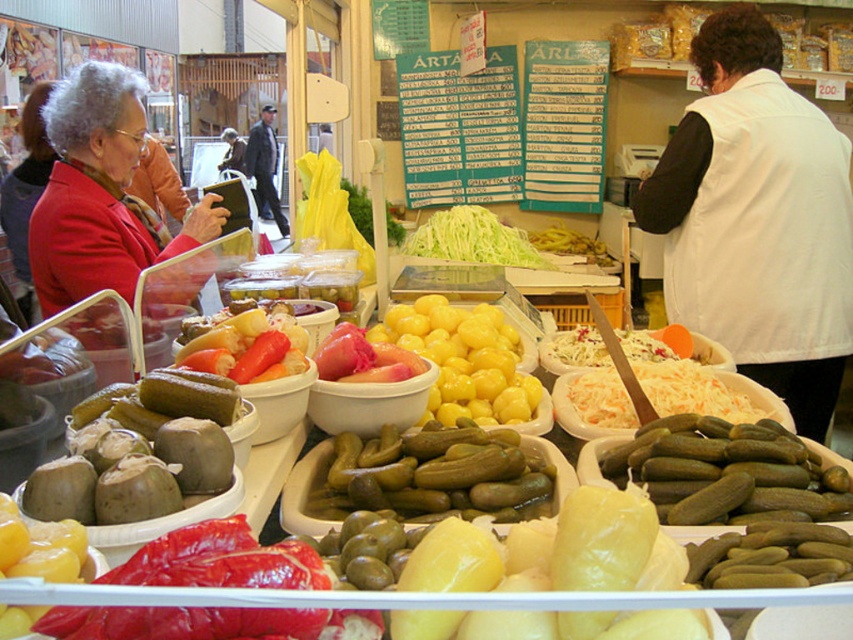
You are a customer at the market stall and want to buy the green pickles at center. However, you notice the leather jacket at center is blocking your view of them. Can you tell me which item is smaller so you can decide if you can see around the jacket?

The green pickles at center is smaller than the leather jacket at center, so you might be able to see around the jacket if you move slightly to the side since the pickles are smaller.

You are a customer at the market stall and want to grab the shiny red pepper at lower left. However, there is a white cotton vest at center in the way. Can you reach the pepper without moving the vest?

The white cotton vest at center is much taller than the shiny red pepper at lower left, so you might not be able to see or reach the pepper easily because the vest is blocking the view and access.

What is located at the coordinates point (432, 474) in the market stall scene?

The point (432, 474) is located on the green pickles at center.